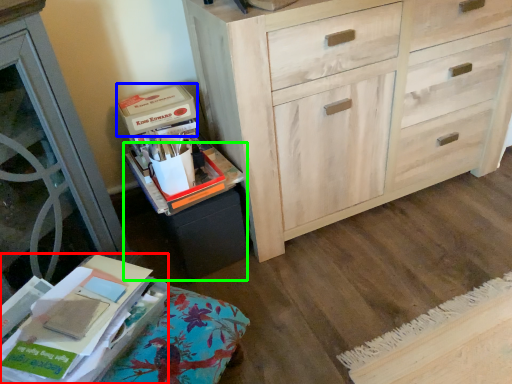
Question: Estimate the real-world distances between objects in this image. Which object is farther from paperback book (highlighted by a red box), storage box (highlighted by a blue box) or cabinetry (highlighted by a green box)?

Choices:
 (A) storage box
 (B) cabinetry

Answer: (A)